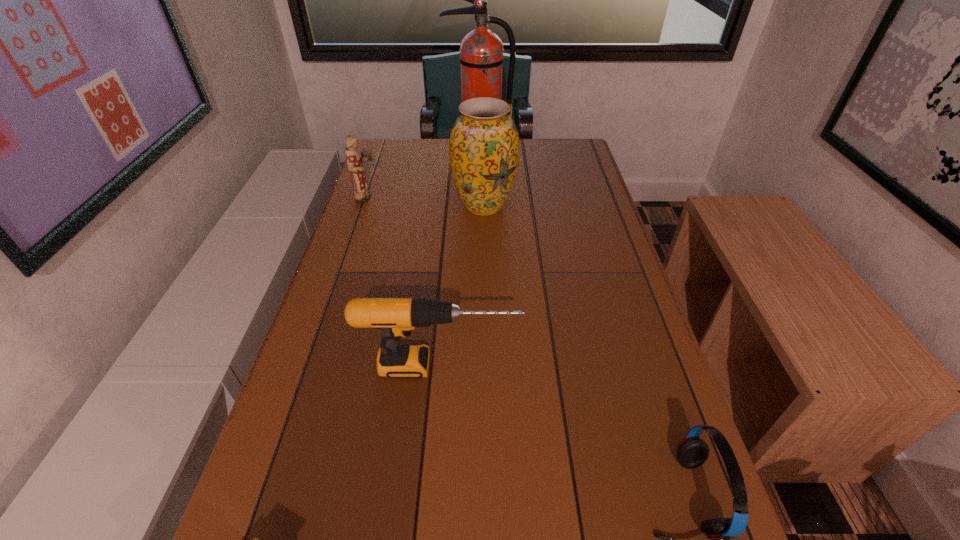
Where is `figurine that is at the left edge`? The height and width of the screenshot is (540, 960). figurine that is at the left edge is located at coordinates (361, 195).

The height and width of the screenshot is (540, 960). I want to click on drill at the left edge, so pyautogui.click(x=396, y=317).

Find the location of a particular element. free space at the left edge of the desktop is located at coordinates (329, 291).

The width and height of the screenshot is (960, 540). Find the location of `vacant space at the right edge`. vacant space at the right edge is located at coordinates (639, 370).

At what (x,y) coordinates should I click in order to perform the action: click on free space at the far left corner. Please return your answer as a coordinate pair (x, y). The image size is (960, 540). Looking at the image, I should click on (394, 152).

Locate an element on the screen. vacant space at the far right corner of the desktop is located at coordinates (572, 162).

What are the coordinates of `free spot between the figurine and the farthest object` in the screenshot? It's located at (423, 175).

Locate an element on the screen. The image size is (960, 540). free space between the vase and the fourth farthest object is located at coordinates (462, 286).

The width and height of the screenshot is (960, 540). What are the coordinates of `unoccupied position between the figurine and the second tallest object` in the screenshot? It's located at (425, 202).

At what (x,y) coordinates should I click in order to perform the action: click on free point between the farthest object and the figurine. Please return your answer as a coordinate pair (x, y). This screenshot has width=960, height=540. Looking at the image, I should click on (423, 175).